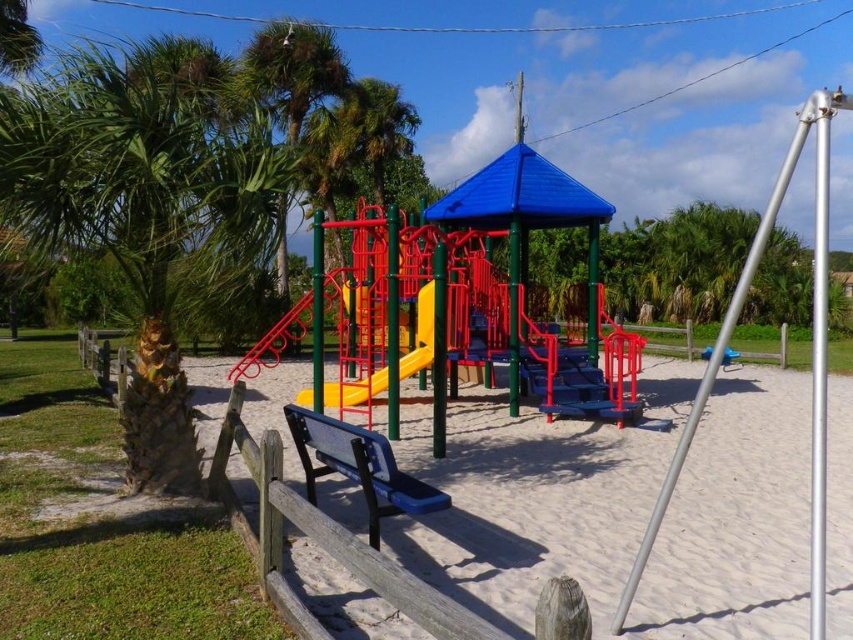
Question: Which point is closer to the camera?

Choices:
 (A) (820, 465)
 (B) (498, 467)
 (C) (410, 352)

Answer: (A)

Question: Which of these objects is positioned closest to the green leafy palm tree at left?

Choices:
 (A) silver metallic swing set pole at right
 (B) yellow plastic slide at center
 (C) white sand at center

Answer: (C)

Question: Based on their relative distances, which object is farther from the yellow plastic slide at center?

Choices:
 (A) green leafy palm tree at upper left
 (B) blue painted wood park bench at center
 (C) silver metallic swing set pole at right
 (D) white sand at center

Answer: (A)

Question: Does silver metallic swing set pole at right appear on the right side of blue painted wood park bench at center?

Choices:
 (A) no
 (B) yes

Answer: (B)

Question: Is white sand at center above blue painted wood park bench at center?

Choices:
 (A) no
 (B) yes

Answer: (A)

Question: Is green leafy palm tree at left above silver metallic swing set pole at right?

Choices:
 (A) yes
 (B) no

Answer: (A)